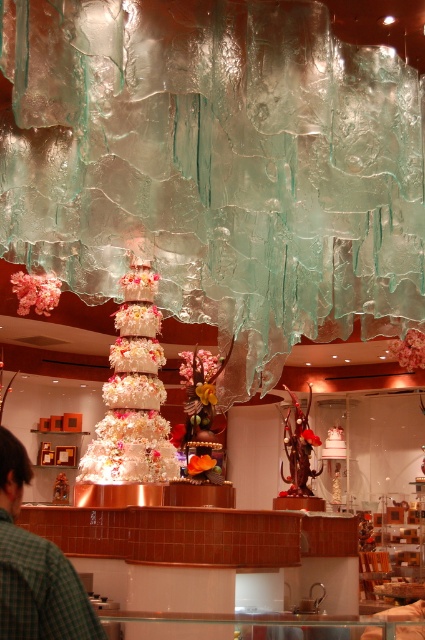
Question: Which point is farther to the camera?

Choices:
 (A) (14, 451)
 (B) (127, 339)

Answer: (B)

Question: Is white textured cake at center above green checkered shirt at lower left?

Choices:
 (A) no
 (B) yes

Answer: (A)

Question: Does white textured cake at center have a larger size compared to green checkered shirt at lower left?

Choices:
 (A) yes
 (B) no

Answer: (A)

Question: Can you confirm if white textured cake at center is bigger than green checkered shirt at lower left?

Choices:
 (A) no
 (B) yes

Answer: (B)

Question: Which point is closer to the camera?

Choices:
 (A) (5, 496)
 (B) (153, 340)

Answer: (A)

Question: Which of the following is the closest to the observer?

Choices:
 (A) green checkered shirt at lower left
 (B) white textured cake at center

Answer: (A)